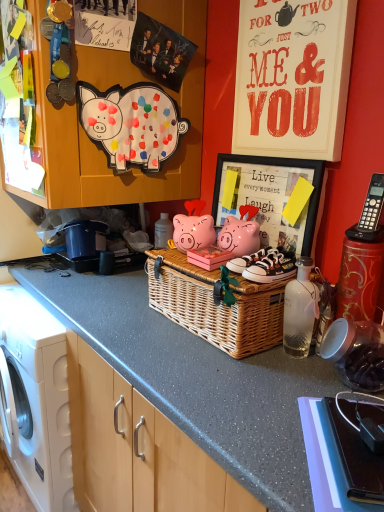
Question: From the image's perspective, is white canvas sneakers at center, which is counted as the 2th footwear, starting from the front, above or below white paper at upper right?

Choices:
 (A) below
 (B) above

Answer: (A)

Question: Is white canvas sneakers at center, which is counted as the 2th footwear, starting from the front, bigger or smaller than white paper at upper right?

Choices:
 (A) small
 (B) big

Answer: (A)

Question: Estimate the real-world distances between objects in this image. Which object is closer to the matte pink piggy bank at center, which ranks as the first pig in bottom-to-top order?

Choices:
 (A) white paper at upper right
 (B) wooden framed picture at upper right
 (C) white canvas sneakers at center, arranged as the first footwear when viewed from the front
 (D) white canvas sneakers at center, the first footwear viewed from the back
 (E) woven wicker basket at center

Answer: (E)

Question: Which of these objects is positioned closest to the white canvas sneakers at center, arranged as the second footwear when viewed from the back?

Choices:
 (A) woven wicker basket at center
 (B) transparent glass bottle at center
 (C) black plastic phone at upper right
 (D) matte paper pig at upper left, the 2th pig positioned from the bottom
 (E) matte pink piggy bank at center, the 2th pig positioned from the top

Answer: (B)